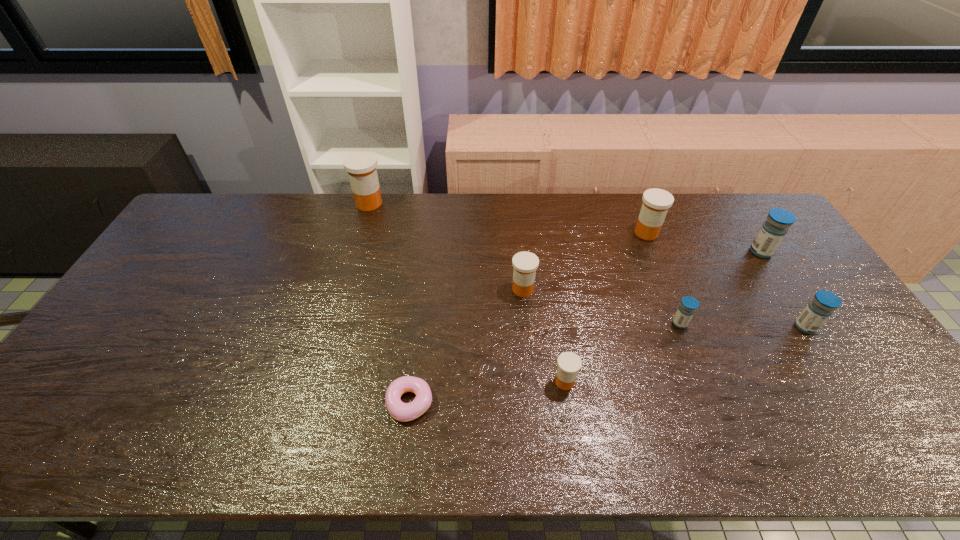
You are a GUI agent. You are given a task and a screenshot of the screen. Output one action in this format:
    pyautogui.click(x=<x>, y=<y>)
    Task: Click on the farthest object
    
    Given the screenshot: What is the action you would take?
    pyautogui.click(x=361, y=166)

Locate an element on the screen. This screenshot has height=540, width=960. the biggest orange medicine is located at coordinates (361, 166).

Find the location of `the second farthest medicine`. the second farthest medicine is located at coordinates (656, 202).

Where is `the second farthest orange medicine`? The image size is (960, 540). the second farthest orange medicine is located at coordinates pyautogui.click(x=656, y=202).

Where is `the farthest blue medicine`? the farthest blue medicine is located at coordinates (x=772, y=232).

This screenshot has width=960, height=540. What are the coordinates of `the third farthest medicine` in the screenshot? It's located at (772, 232).

You are a GUI agent. You are given a task and a screenshot of the screen. Output one action in this format:
    pyautogui.click(x=<x>, y=<y>)
    Task: Click on the fourth farthest object
    This screenshot has height=540, width=960.
    Given the screenshot: What is the action you would take?
    pyautogui.click(x=525, y=264)

Where is `the second orange medicine from left to right`? the second orange medicine from left to right is located at coordinates (525, 264).

The height and width of the screenshot is (540, 960). In order to click on the second biggest blue medicine in this screenshot , I will do `click(818, 310)`.

Where is `the leftmost blue medicine`? The height and width of the screenshot is (540, 960). the leftmost blue medicine is located at coordinates (686, 310).